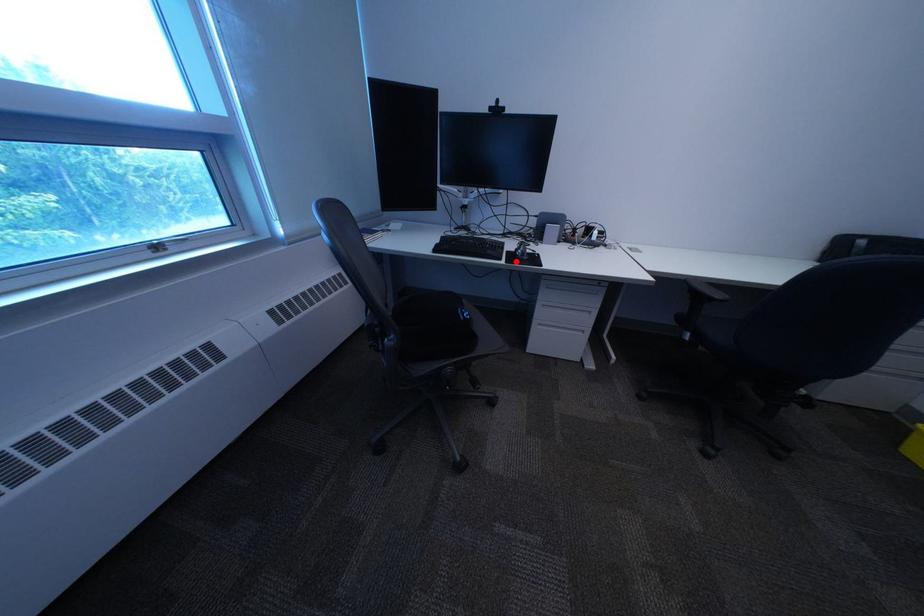
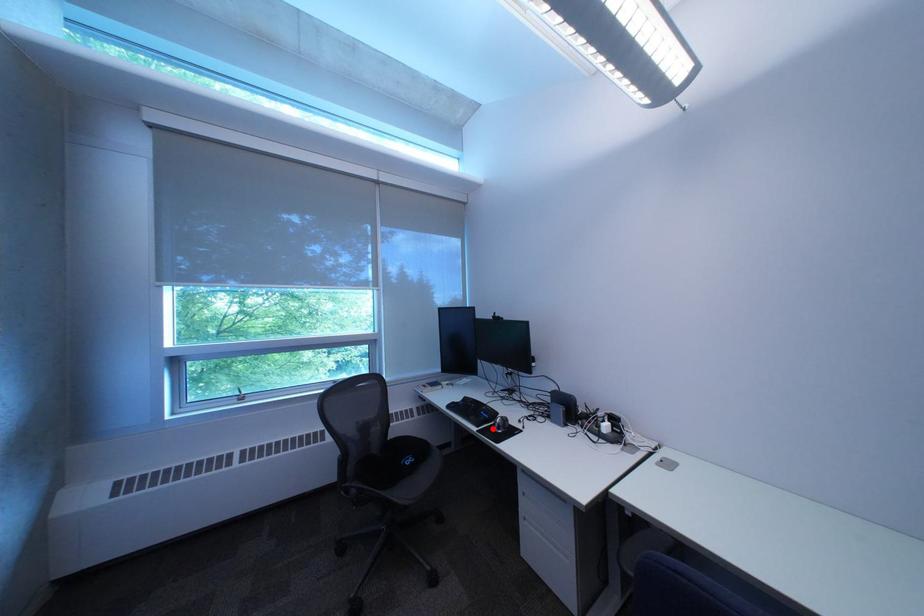
I am providing you with two images of the same scene from different viewpoints. A red point is marked on the first image and another point is marked on the second image. Is the marked point in image1 the same physical position as the marked point in image2?

Yes